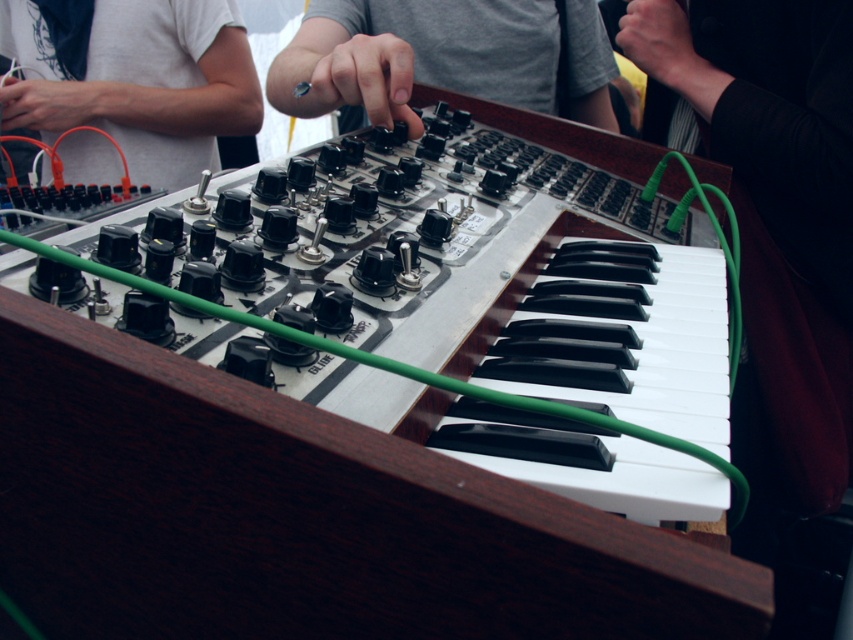
Does point (91, 68) come behind point (399, 115)?

Yes, it is.

Locate an element on the screen. white matte shirt at upper left is located at coordinates [132, 77].

This screenshot has height=640, width=853. Find the location of `white matte shirt at upper left`. white matte shirt at upper left is located at coordinates (132, 77).